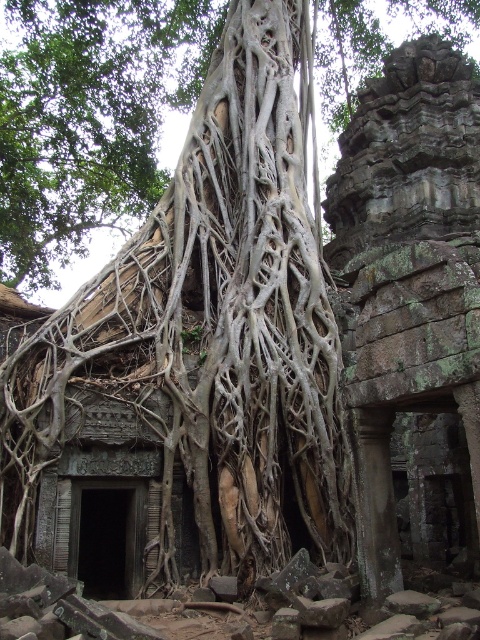
From the picture: You are an archaeologist examining the ancient stone structure in the image. You notice two points marked on the structure. Which of the two points, point [227,257] or point [84,67], is closer to your viewpoint?

Point [227,257] is closer to the camera than point [84,67].

Based on the scene description, what object is located at the coordinates point (211, 330)?

The gray textured roots at center are located at point (211, 330).

You are an archaeologist examining the ancient stone structure. You notice two sets of roots, the gray textured roots at center and the white textured roots at center. Which set of roots has a smaller width?

The gray textured roots at center have a smaller width compared to the white textured roots at center as stated in the description.